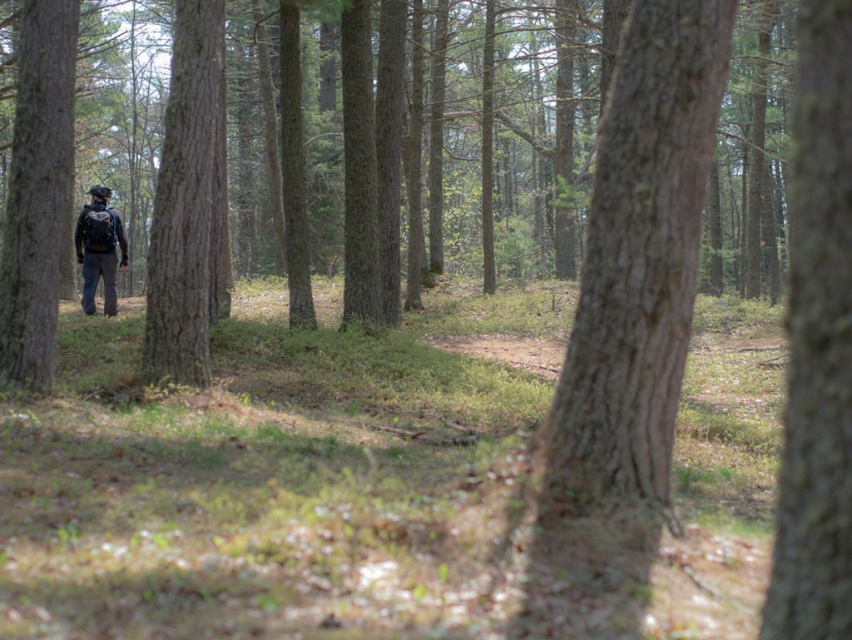
Does smooth bark tree at left have a lesser width compared to dark blue backpack at center?

No, smooth bark tree at left is not thinner than dark blue backpack at center.

Consider the image. Does smooth bark tree at left appear under dark blue backpack at center?

Actually, smooth bark tree at left is above dark blue backpack at center.

Is point (52, 310) in front of point (104, 253)?

Yes.

This screenshot has height=640, width=852. Find the location of `smooth bark tree at left`. smooth bark tree at left is located at coordinates (37, 193).

Measure the distance between rough bark tree at left and dark blue backpack at center.

They are 8.66 meters apart.

Between point (210, 4) and point (102, 310), which one is positioned in front?

Positioned in front is point (210, 4).

In order to click on rough bark tree at left in this screenshot , I will do `click(185, 204)`.

Is point (844, 204) positioned before point (47, 80)?

Yes, point (844, 204) is in front of point (47, 80).

Does smooth bark tree at right come behind smooth bark tree at left?

No, it is not.

Does point (816, 193) lie behind point (26, 179)?

No, it is not.

Locate an element on the screen. The image size is (852, 640). smooth bark tree at right is located at coordinates (816, 342).